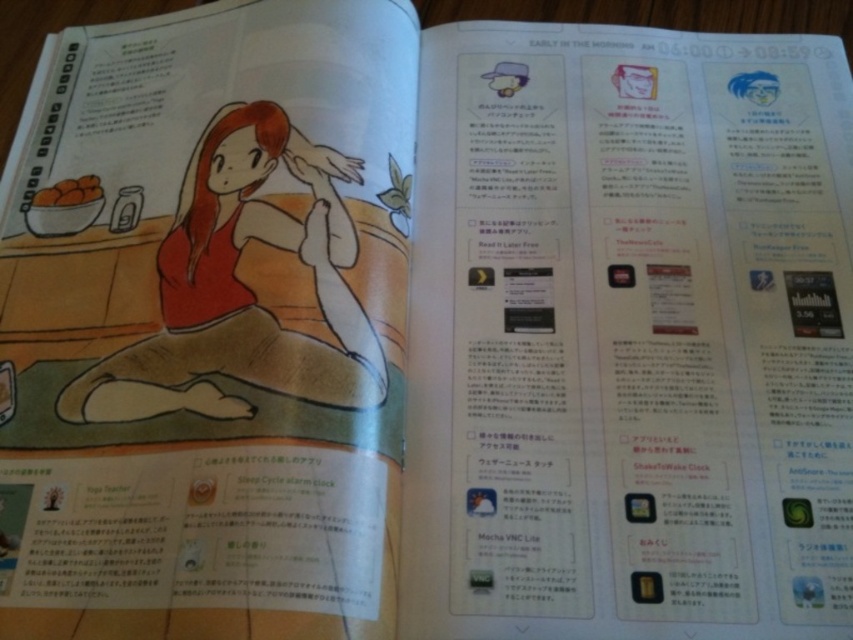
Question: Can you confirm if matte red dress at center is wider than brown matte bowl at upper left?

Choices:
 (A) yes
 (B) no

Answer: (A)

Question: Which of the following is the farthest from the observer?

Choices:
 (A) matte red dress at center
 (B) brown matte bowl at upper left

Answer: (B)

Question: Does matte red dress at center appear on the right side of brown matte bowl at upper left?

Choices:
 (A) yes
 (B) no

Answer: (A)

Question: Is matte red dress at center bigger than brown matte bowl at upper left?

Choices:
 (A) yes
 (B) no

Answer: (A)